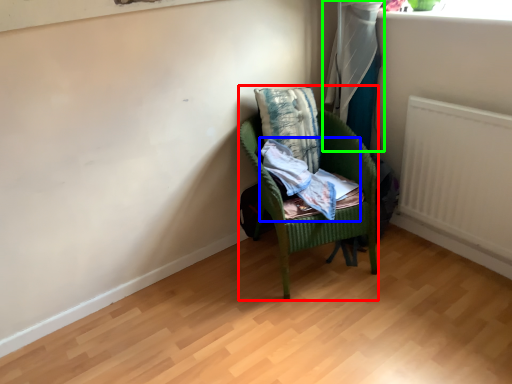
Question: Based on their relative distances, which object is nearer to chair (highlighted by a red box)? Choose from clothing (highlighted by a blue box) and curtain (highlighted by a green box).

Choices:
 (A) clothing
 (B) curtain

Answer: (A)